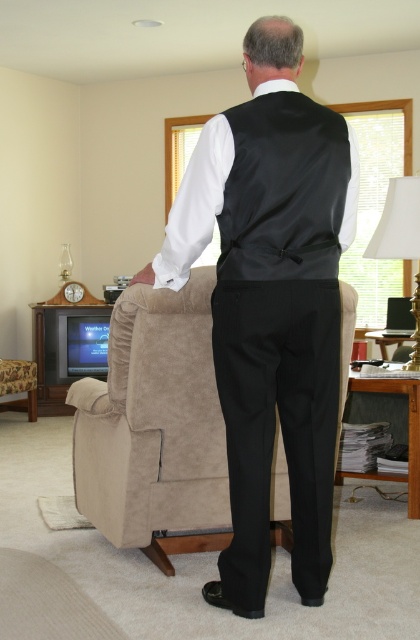
Between satin black vest at center and white fabric lampshade at upper right, which one has more height?

With more height is satin black vest at center.

Which is in front, point (207, 164) or point (399, 237)?

Point (207, 164) is more forward.

Who is more forward, (239, 308) or (403, 228)?

Point (239, 308)

I want to click on satin black vest at center, so pos(270,304).

Which is more to the left, suede armchair at center or black satin vest at center?

Positioned to the left is suede armchair at center.

Does suede armchair at center have a larger size compared to black satin vest at center?

Yes.

Who is more distant from viewer, (142, 294) or (307, 184)?

Point (142, 294)

The width and height of the screenshot is (420, 640). What are the coordinates of `suede armchair at center` in the screenshot? It's located at (154, 426).

Does suede armchair at center have a lesser height compared to white fabric lampshade at upper right?

In fact, suede armchair at center may be taller than white fabric lampshade at upper right.

Does suede armchair at center appear over white fabric lampshade at upper right?

No.

The height and width of the screenshot is (640, 420). Find the location of `suede armchair at center`. suede armchair at center is located at coordinates (154, 426).